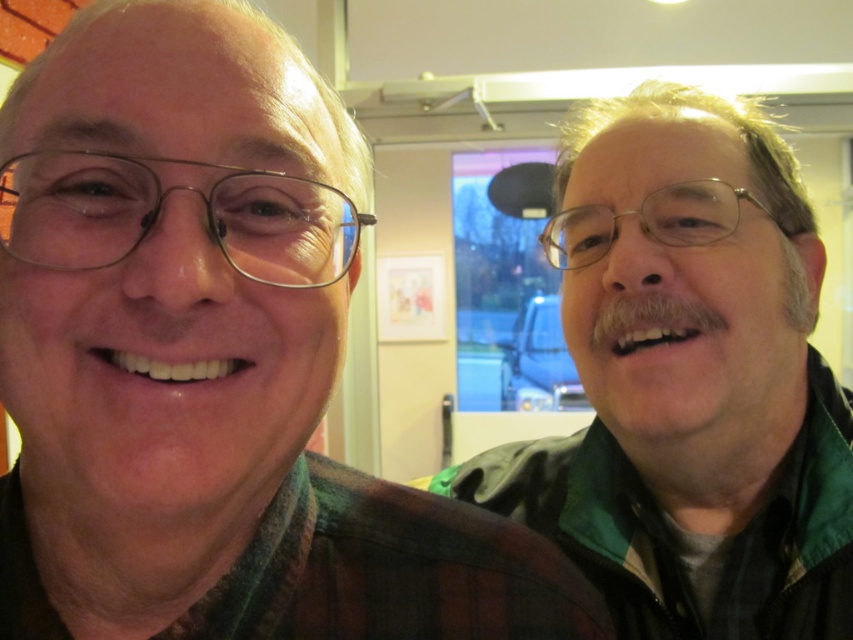
You are standing in front of the two people taking a selfie. There is a green plaid shirt at upper right marked by point (213, 365). If you want to take a photo of the green plaid shirt at upper right, where should you aim your camera?

You should aim your camera at the point marked (213, 365) where the green plaid shirt at upper right is located.

You are a photographer trying to capture a clear photo of both the green plaid shirt at upper right and the green matte jacket at right. Which one should you focus on first to ensure it appears sharp in the photo?

The green plaid shirt at upper right is closer to the viewer than the green matte jacket at right, so you should focus on the green plaid shirt at upper right first to ensure it appears sharp in the photo.